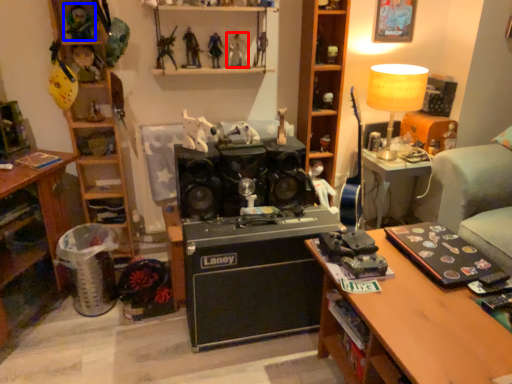
Question: Among these objects, which one is nearest to the camera, toy (highlighted by a red box) or toy (highlighted by a blue box)?

Choices:
 (A) toy
 (B) toy

Answer: (B)